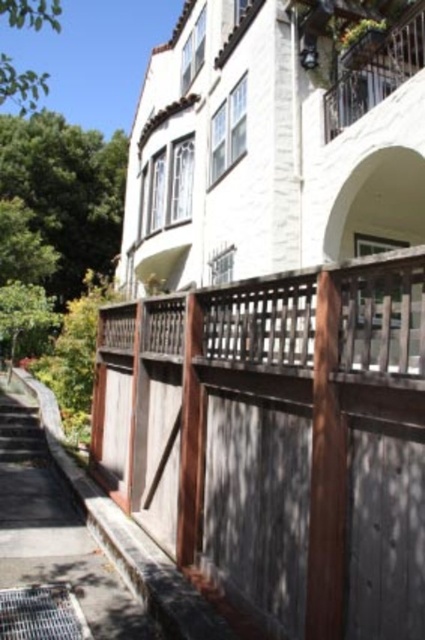
This screenshot has width=425, height=640. Find the location of `green leafy tree at upper left`. green leafy tree at upper left is located at coordinates (67, 188).

Can you confirm if green leafy tree at upper left is positioned to the right of metallic wrought iron balcony at upper right?

Incorrect, green leafy tree at upper left is not on the right side of metallic wrought iron balcony at upper right.

What do you see at coordinates (67, 188) in the screenshot? I see `green leafy tree at upper left` at bounding box center [67, 188].

Find the location of a particular element. The height and width of the screenshot is (640, 425). green leafy tree at upper left is located at coordinates pos(67,188).

Is brown wood fence at center bigger than metallic wrought iron balcony at upper right?

Yes.

Is brown wood fence at center smaller than metallic wrought iron balcony at upper right?

Incorrect, brown wood fence at center is not smaller in size than metallic wrought iron balcony at upper right.

Is point (351, 502) farther from viewer compared to point (394, 45)?

No, (351, 502) is closer to viewer.

At what (x,y) coordinates should I click in order to perform the action: click on brown wood fence at center. Please return your answer as a coordinate pair (x, y). This screenshot has height=640, width=425. Looking at the image, I should click on (280, 438).

Between point (246, 280) and point (99, 202), which one is positioned in front?

Point (246, 280) is more forward.

What are the coordinates of `brown wood fence at center` in the screenshot? It's located at (280, 438).

Where is `brown wood fence at center`? The width and height of the screenshot is (425, 640). brown wood fence at center is located at coordinates (280, 438).